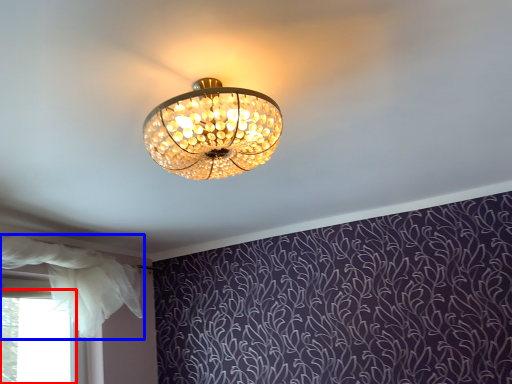
Question: Which object appears farthest to the camera in this image, bay window (highlighted by a red box) or curtain (highlighted by a blue box)?

Choices:
 (A) bay window
 (B) curtain

Answer: (A)